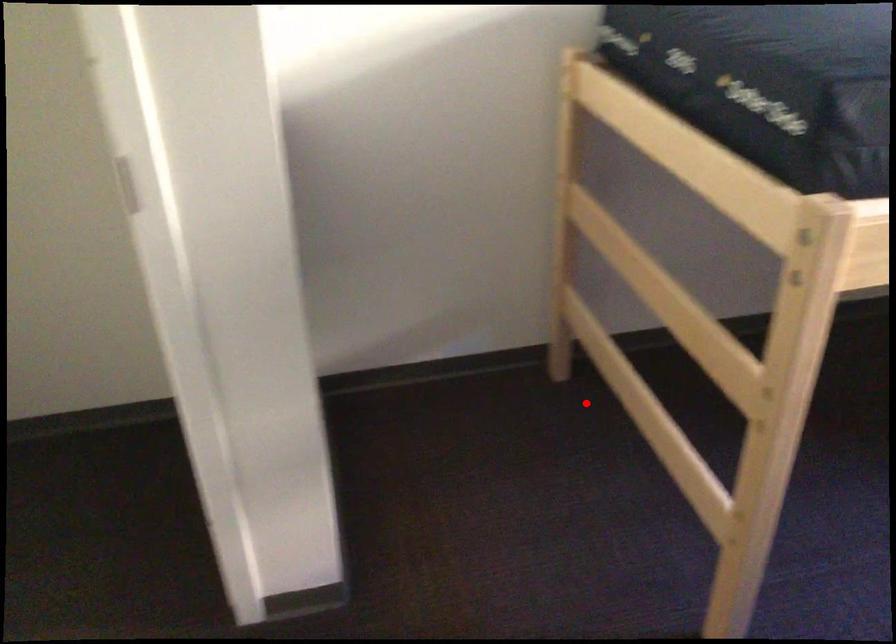
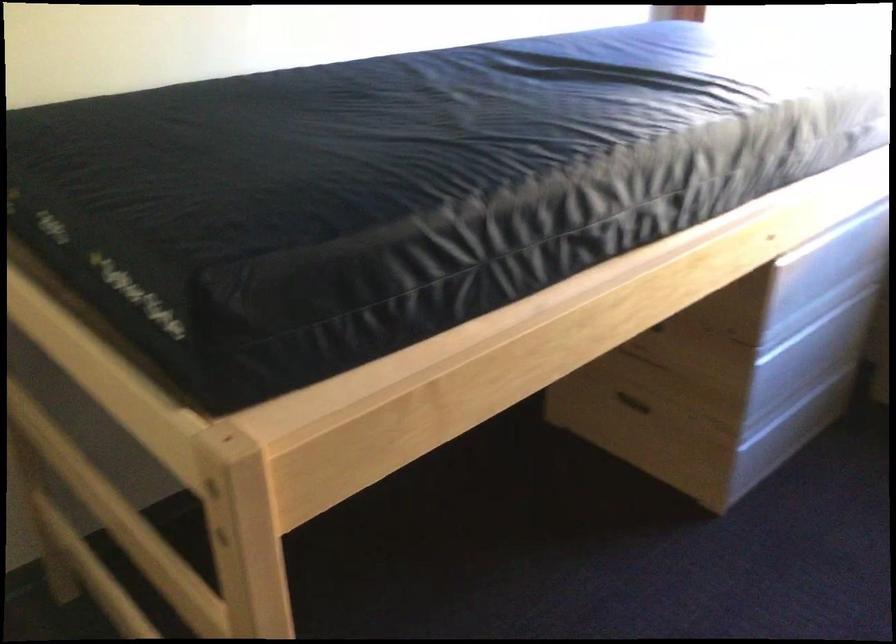
The point at the highlighted location is marked in the first image. Where is the corresponding point in the second image?

(112, 632)